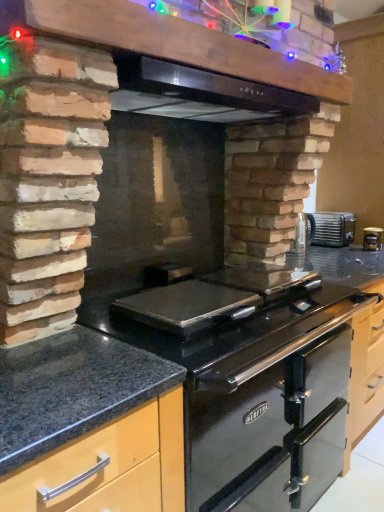
Measure the distance between point (257, 95) and camera.

Point (257, 95) is 4.46 feet from camera.

Measure the distance between point (83, 375) and camera.

Point (83, 375) and camera are 39.02 inches apart from each other.

In order to click on metallic black vent at upper center in this screenshot , I will do `click(181, 44)`.

In order to face black stainless steel gas stove at center, should I rotate leftwards or rightwards?

Turn right approximately 4.493 degrees to face it.

Measure the distance between point (371, 229) and camera.

The depth of point (371, 229) is 8.69 feet.

Describe the element at coordinates (330, 229) in the screenshot. This screenshot has width=384, height=512. I see `metallic silver toaster at upper center` at that location.

Locate an element on the screen. granite countertop at lower left, the 1th countertop viewed from the right is located at coordinates (179, 396).

Is metallic black vent at upper center surrounded by black stainless steel gas stove at center?

No, metallic black vent at upper center is not inside black stainless steel gas stove at center.

Does black stainless steel gas stove at center touch metallic black vent at upper center?

black stainless steel gas stove at center and metallic black vent at upper center are not in contact.

Is black stainless steel gas stove at center closer to the viewer compared to metallic black vent at upper center?

No, the depth of black stainless steel gas stove at center is greater than that of metallic black vent at upper center.

In the image, is matte black canister at upper right on the left side or the right side of black stainless steel gas stove at center?

matte black canister at upper right is to the right of black stainless steel gas stove at center.

Is black stainless steel gas stove at center at the back of matte black canister at upper right?

No, matte black canister at upper right is not facing away from black stainless steel gas stove at center.

In terms of size, does matte black canister at upper right appear bigger or smaller than black stainless steel gas stove at center?

A: matte black canister at upper right is smaller than black stainless steel gas stove at center.

From a real-world perspective, is matte black canister at upper right physically below granite countertop at lower left, placed as the second countertop when sorted from left to right?

No.

Which is more to the left, matte black canister at upper right or granite countertop at lower left, placed as the second countertop when sorted from left to right?

granite countertop at lower left, placed as the second countertop when sorted from left to right.

Looking at the image, does matte black canister at upper right seem bigger or smaller compared to granite countertop at lower left, placed as the second countertop when sorted from left to right?

Clearly, matte black canister at upper right is smaller in size than granite countertop at lower left, placed as the second countertop when sorted from left to right.

From a real-world perspective, does matte black canister at upper right stand above metallic black vent at upper center?

No, from a real-world perspective, matte black canister at upper right is not above metallic black vent at upper center.

Considering the points (375, 230) and (99, 10), which point is behind, point (375, 230) or point (99, 10)?

Point (375, 230)

Looking at the image, does matte black canister at upper right seem bigger or smaller compared to metallic black vent at upper center?

matte black canister at upper right is smaller than metallic black vent at upper center.

From the image's perspective, which is above, matte black canister at upper right or metallic black vent at upper center?

metallic black vent at upper center appears higher in the image.

Does black stainless steel exhaust hood at upper center lie behind metallic silver toaster at upper center?

No.

Is metallic silver toaster at upper center at the back of black stainless steel exhaust hood at upper center?

No, metallic silver toaster at upper center is not at the back of black stainless steel exhaust hood at upper center.

From the image's perspective, is black stainless steel exhaust hood at upper center over metallic silver toaster at upper center?

Yes, from the image's perspective, black stainless steel exhaust hood at upper center is above metallic silver toaster at upper center.

Is black stainless steel exhaust hood at upper center surrounded by metallic black vent at upper center?

That's incorrect, black stainless steel exhaust hood at upper center is not inside metallic black vent at upper center.

Is metallic black vent at upper center shorter than black stainless steel exhaust hood at upper center?

No, metallic black vent at upper center is not shorter than black stainless steel exhaust hood at upper center.

The image size is (384, 512). Find the location of `exhaust hood below the metallic black vent at upper center (from a real-world perspective)`. exhaust hood below the metallic black vent at upper center (from a real-world perspective) is located at coordinates (200, 93).

Does metallic black vent at upper center have a greater width compared to black stainless steel exhaust hood at upper center?

No, metallic black vent at upper center is not wider than black stainless steel exhaust hood at upper center.

Could you measure the distance between granite at center, which is the second countertop from right to left, and metallic black vent at upper center?

granite at center, which is the second countertop from right to left, is 81.21 centimeters from metallic black vent at upper center.

Is granite at center, which is the first countertop in left-to-right order, inside the boundaries of metallic black vent at upper center, or outside?

granite at center, which is the first countertop in left-to-right order, is outside metallic black vent at upper center.

Is granite at center, which is the second countertop from right to left, facing towards metallic black vent at upper center?

No, granite at center, which is the second countertop from right to left, is not aimed at metallic black vent at upper center.

From the image's perspective, is granite at center, which is the second countertop from right to left, on top of metallic black vent at upper center?

Actually, granite at center, which is the second countertop from right to left, appears below metallic black vent at upper center in the image.

There is a black stainless steel gas stove at center. At what (x,y) coordinates should I click in order to perform the action: click on vent above it (from a real-world perspective). Please return your answer as a coordinate pair (x, y). This screenshot has height=512, width=384. Looking at the image, I should click on (181, 44).

Image resolution: width=384 pixels, height=512 pixels. What are the coordinates of `kitchen appliance that is above the black stainless steel gas stove at center (from the image's perspective)` in the screenshot? It's located at (372, 238).

When comparing their distances from metallic silver toaster at upper center, does granite at center, which is the first countertop in left-to-right order, or black stainless steel exhaust hood at upper center seem further?

The object further to metallic silver toaster at upper center is granite at center, which is the first countertop in left-to-right order.

Based on their spatial positions, is granite countertop at lower left, placed as the second countertop when sorted from left to right, or black stainless steel exhaust hood at upper center closer to metallic silver toaster at upper center?

black stainless steel exhaust hood at upper center.

Considering their positions, is granite at center, which is the second countertop from right to left, positioned closer to black stainless steel exhaust hood at upper center than black stainless steel gas stove at center?

black stainless steel gas stove at center.

In the scene shown: When comparing their distances from granite countertop at lower left, the 1th countertop viewed from the right, does black stainless steel gas stove at center or metallic black vent at upper center seem closer?

black stainless steel gas stove at center is closer to granite countertop at lower left, the 1th countertop viewed from the right.

Consider the image. Estimate the real-world distances between objects in this image. Which object is further from granite at center, which is the second countertop from right to left, granite countertop at lower left, the 1th countertop viewed from the right, or matte black canister at upper right?

matte black canister at upper right lies further to granite at center, which is the second countertop from right to left, than the other object.

Which object lies further to the anchor point granite countertop at lower left, placed as the second countertop when sorted from left to right, metallic black vent at upper center or black stainless steel exhaust hood at upper center?

Among the two, metallic black vent at upper center is located further to granite countertop at lower left, placed as the second countertop when sorted from left to right.

From the image, which object appears to be nearer to black stainless steel exhaust hood at upper center, metallic black vent at upper center or granite countertop at lower left, the 1th countertop viewed from the right?

metallic black vent at upper center is positioned closer to the anchor black stainless steel exhaust hood at upper center.

Which object lies further to the anchor point metallic black vent at upper center, metallic silver toaster at upper center or granite at center, which is the first countertop in left-to-right order?

metallic silver toaster at upper center.

At what (x,y) coordinates should I click in order to perform the action: click on gas stove positioned between granite at center, which is the second countertop from right to left, and metallic silver toaster at upper center from near to far. Please return your answer as a coordinate pair (x, y). This screenshot has width=384, height=512. Looking at the image, I should click on (213, 321).

This screenshot has width=384, height=512. I want to click on countertop positioned between black stainless steel gas stove at center and matte black canister at upper right from near to far, so click(179, 396).

This screenshot has height=512, width=384. In order to click on countertop between metallic black vent at upper center and matte black canister at upper right in the front-back direction in this screenshot , I will do `click(179, 396)`.

Identify the location of exhaust hood positioned between granite at center, which is the first countertop in left-to-right order, and matte black canister at upper right from near to far. (200, 93).